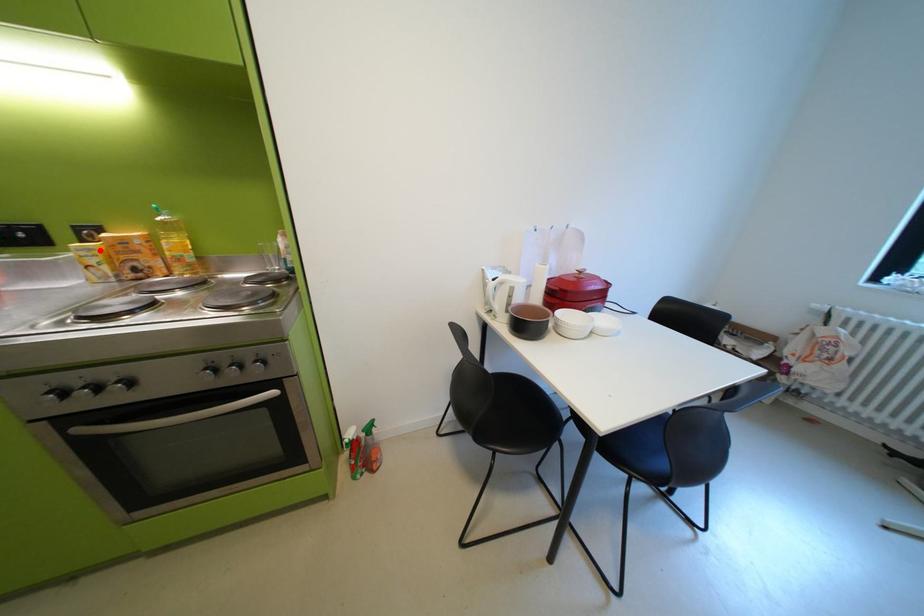
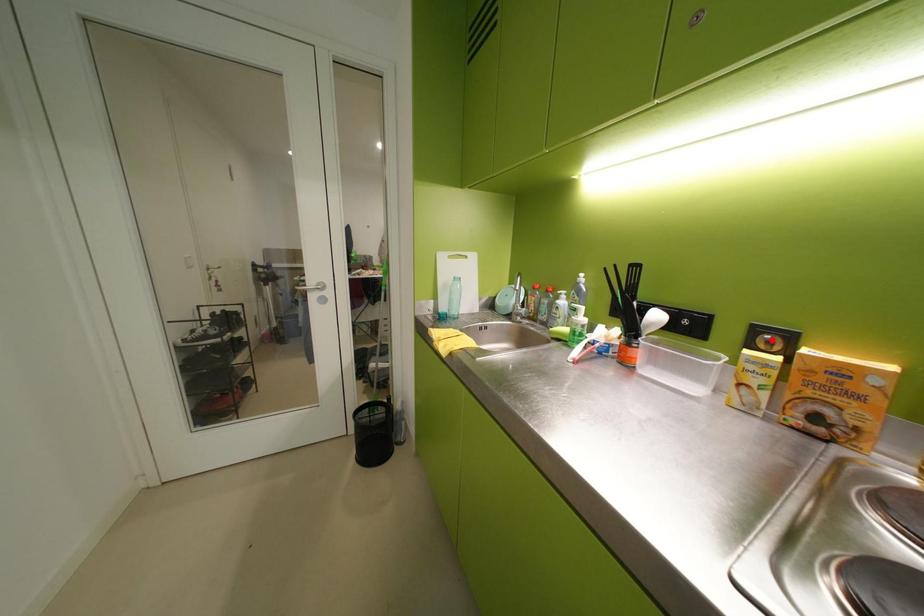
I am providing you with two images of the same scene from different viewpoints. A red point is marked on the first image and another point is marked on the second image. Do the highlighted points in image1 and image2 indicate the same real-world spot?

No